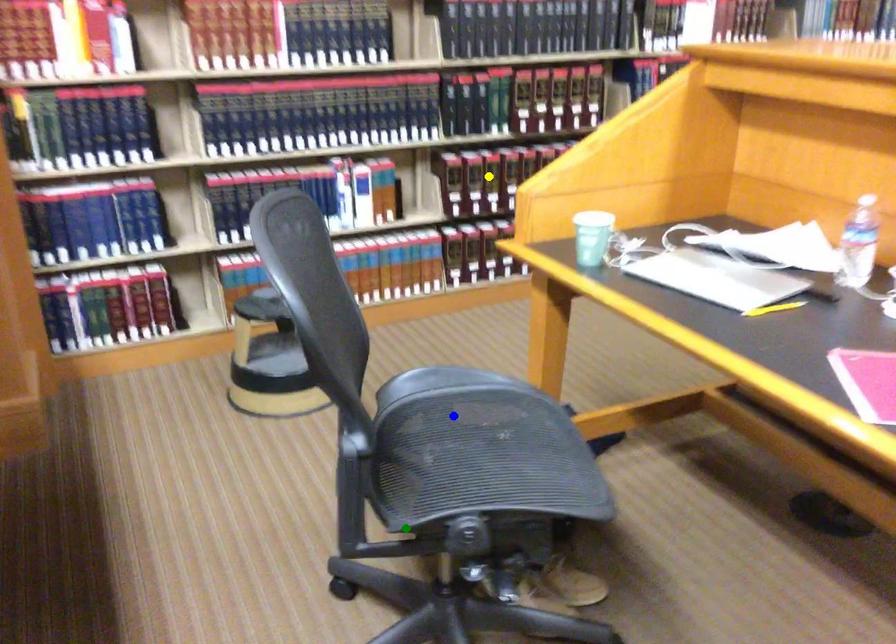
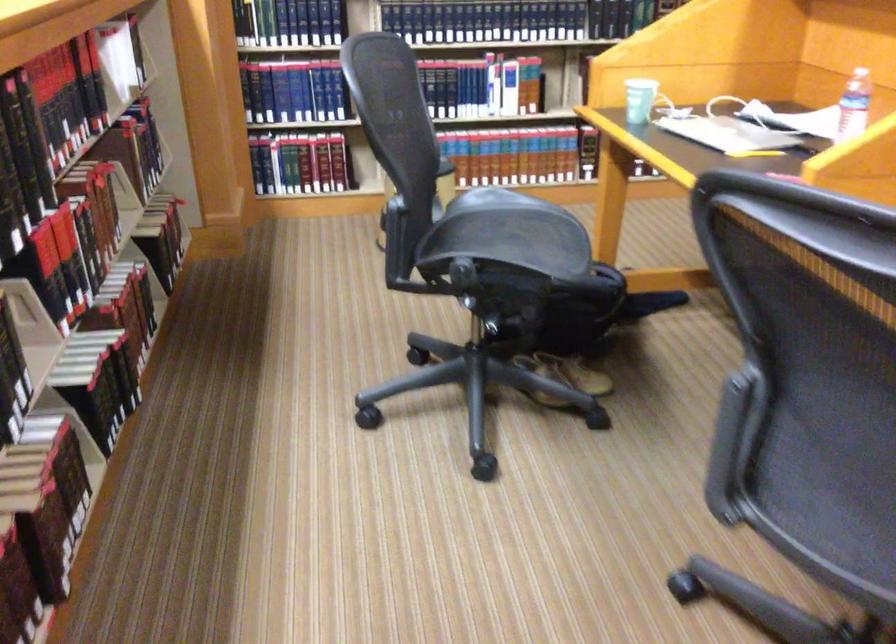
I am providing you with two images of the same scene from different viewpoints. Three points are marked in image1. Which point corresponds to a part or object that is occluded in image2?In image1, three points are marked. Which of them correspond to a part or object that is occluded in image2?Among the three points shown in image1, which one corresponds to a part or object that is no longer visible due to occlusion in image2?

yellow point cannot be seen in image2.